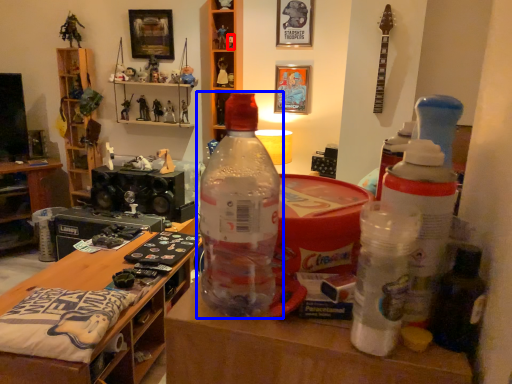
Question: Which of the following is the closest to the observer, toy (highlighted by a red box) or bottle (highlighted by a blue box)?

Choices:
 (A) toy
 (B) bottle

Answer: (B)